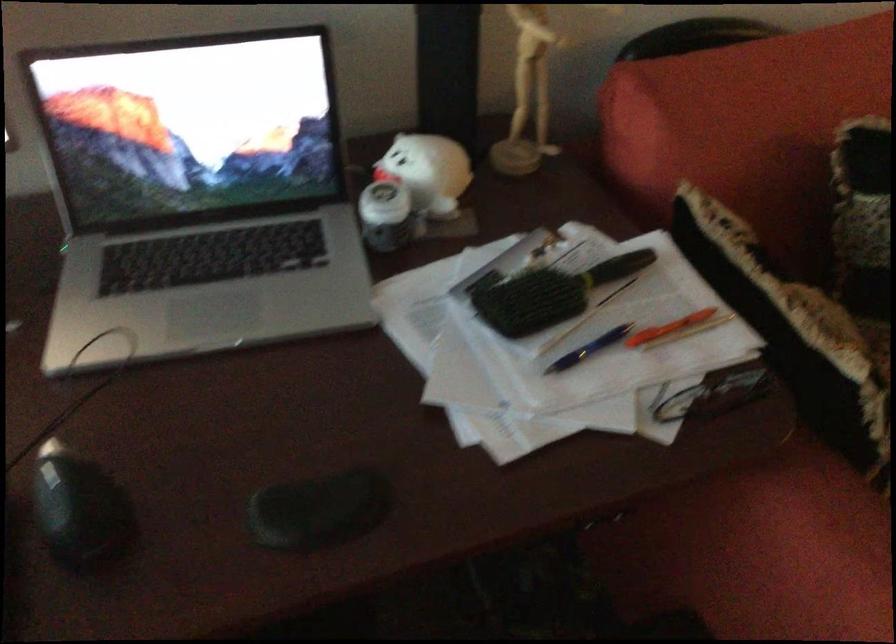
This screenshot has width=896, height=644. In order to click on red sofa armrest in this screenshot , I will do `click(746, 96)`.